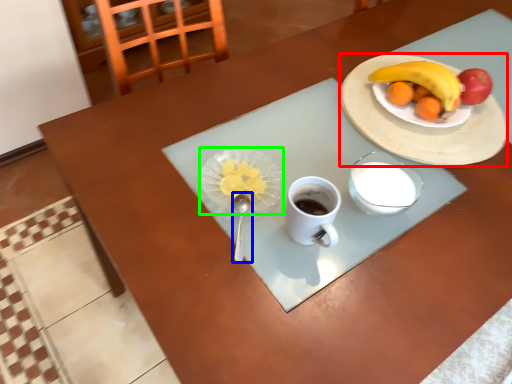
Question: Which is nearer to the plate (highlighted by a red box)? utensil (highlighted by a blue box) or tableware (highlighted by a green box).

Choices:
 (A) utensil
 (B) tableware

Answer: (B)